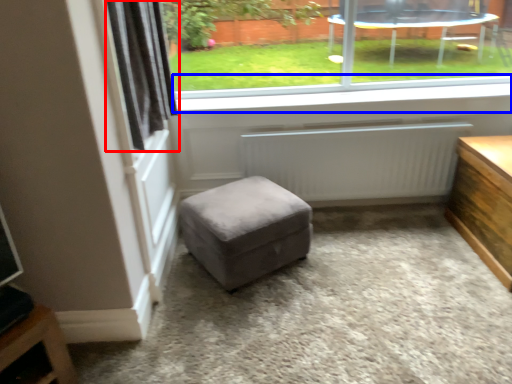
Question: Which object is closer to the camera taking this photo, curtain (highlighted by a red box) or window sill (highlighted by a blue box)?

Choices:
 (A) curtain
 (B) window sill

Answer: (A)